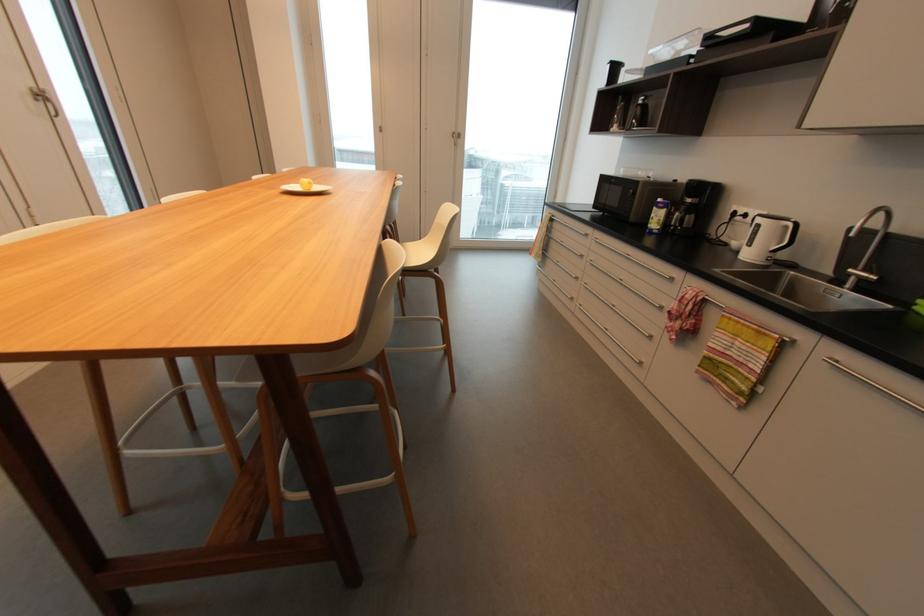
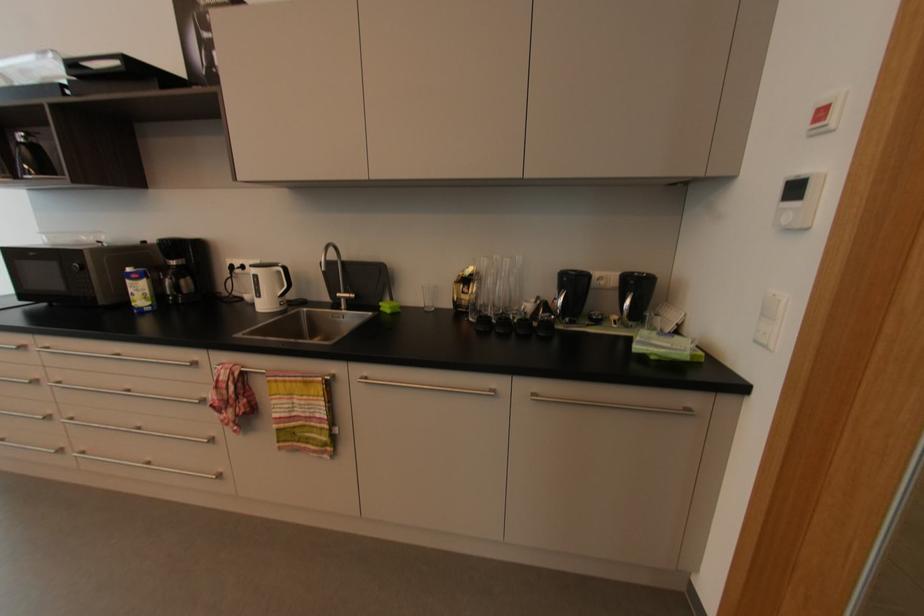
Find the pixel in the second image that matches the point at 663,200 in the first image.

(131, 270)